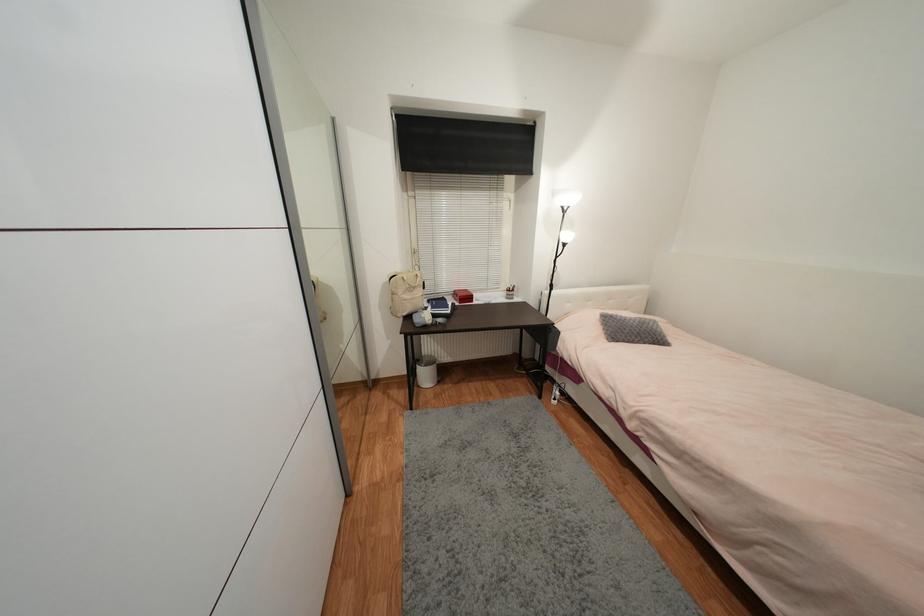
Which object does [631,330] point to?

This point indicates the grey decorative pillow.